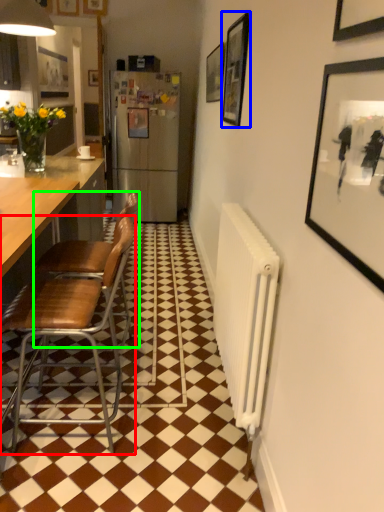
Question: Which is nearer to the chair (highlighted by a red box)? picture frame (highlighted by a blue box) or chair (highlighted by a green box).

Choices:
 (A) picture frame
 (B) chair

Answer: (B)